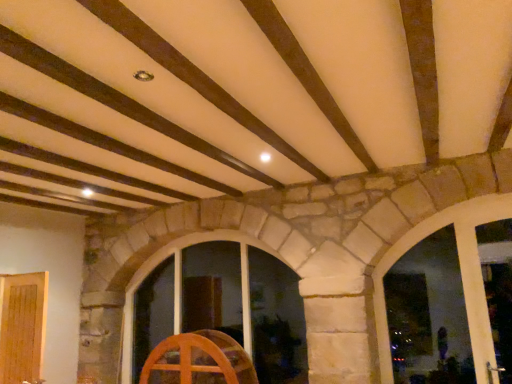
Question: Is point (219, 380) closer or farther from the camera than point (231, 329)?

Choices:
 (A) farther
 (B) closer

Answer: (B)

Question: Considering the positions of wooden wheel at center and wooden window at center, acting as the second window starting from the front, in the image, is wooden wheel at center wider or thinner than wooden window at center, acting as the second window starting from the front,?

Choices:
 (A) thin
 (B) wide

Answer: (A)

Question: Which object is positioned farthest from the light brown wood door at lower left?

Choices:
 (A) wooden wheel at center
 (B) transparent glass window at center, marked as the 2th window in a back-to-front arrangement
 (C) wooden window at center, which is the first window from left to right

Answer: (B)

Question: Based on their relative distances, which object is nearer to the wooden wheel at center?

Choices:
 (A) light brown wood door at lower left
 (B) transparent glass window at center, which is the 1th window from right to left
 (C) wooden window at center, acting as the second window starting from the front

Answer: (C)